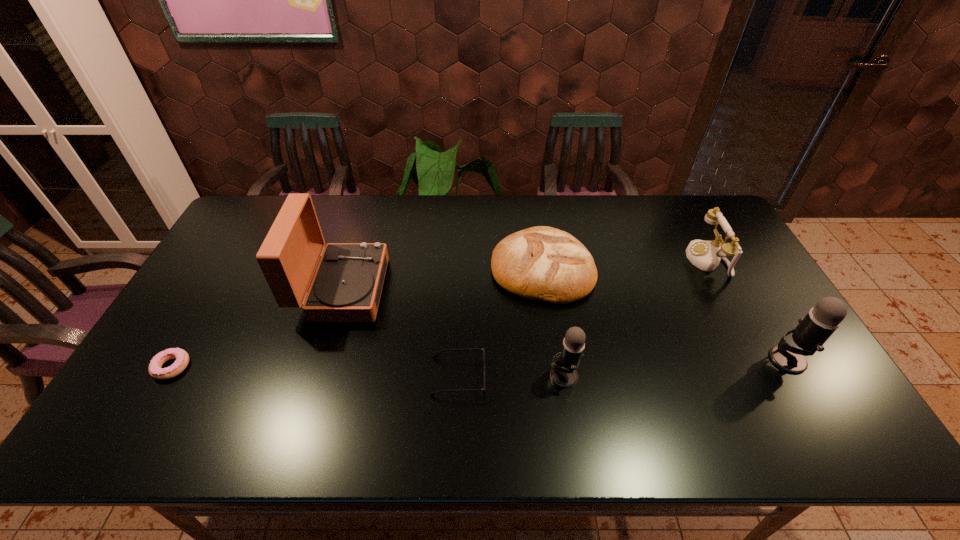
Locate an element on the screen. vacant spot to place a microphone on the left is located at coordinates (326, 392).